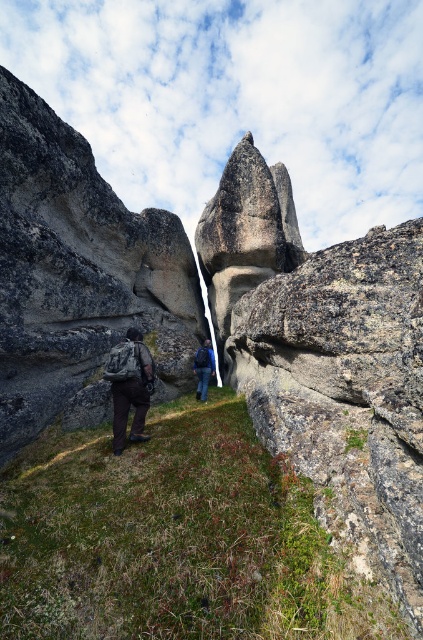
Is dark gray backpack at center positioned in front of blue fabric backpack at center?

Yes, dark gray backpack at center is in front of blue fabric backpack at center.

Consider the image. Which is more to the right, dark gray backpack at center or blue fabric backpack at center?

blue fabric backpack at center

The image size is (423, 640). Describe the element at coordinates (129, 387) in the screenshot. I see `dark gray backpack at center` at that location.

Image resolution: width=423 pixels, height=640 pixels. I want to click on dark gray backpack at center, so click(x=129, y=387).

Between rough gray rock formation at center and blue fabric backpack at center, which one has less height?

blue fabric backpack at center

This screenshot has height=640, width=423. Identify the location of rough gray rock formation at center. (79, 276).

Where is `rough gray rock formation at center`? This screenshot has width=423, height=640. rough gray rock formation at center is located at coordinates (79, 276).

Can you confirm if rough gray rock formation at center is smaller than dark gray backpack at center?

No.

Is point (98, 320) closer to viewer compared to point (137, 413)?

No.

Find the location of a particular element. rough gray rock formation at center is located at coordinates (79, 276).